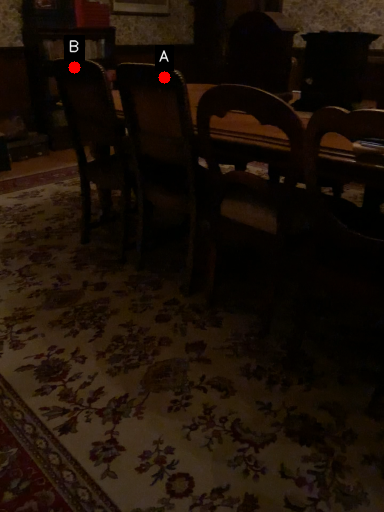
Question: Two points are circled on the image, labeled by A and B beside each circle. Among these points, which one is farthest from the camera?

Choices:
 (A) A is further
 (B) B is further

Answer: (B)